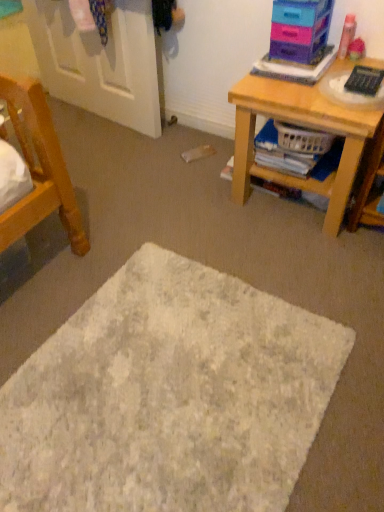
Locate an element on the screen. vacant space that's between white painted wood door at upper left and wooden desk at right is located at coordinates (179, 154).